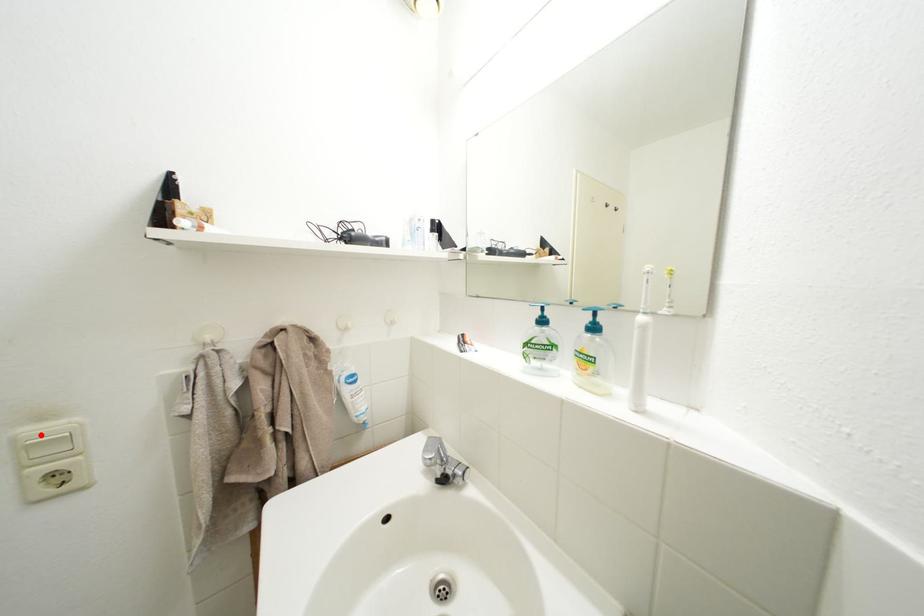
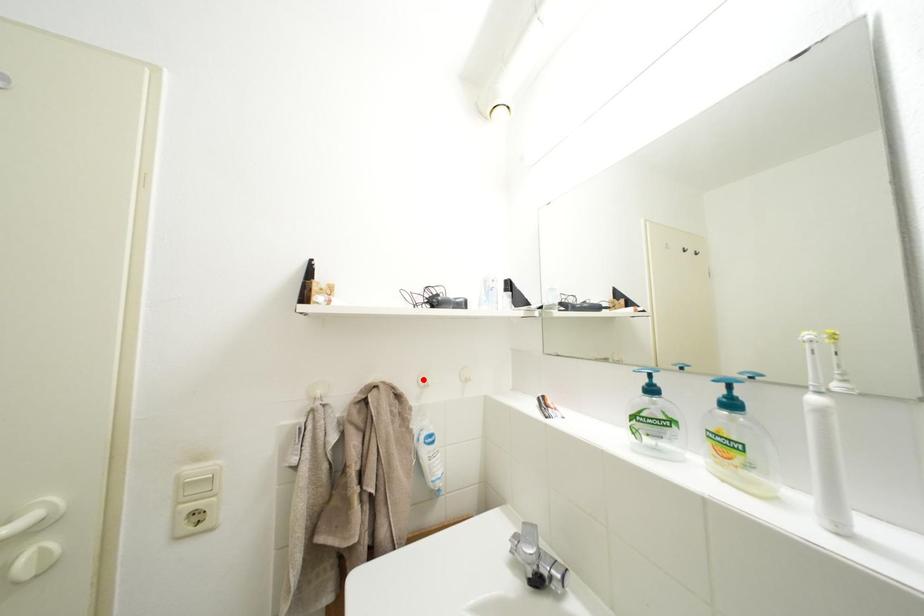
I am providing you with two images of the same scene from different viewpoints. A red point is marked on the first image and another point is marked on the second image. Is the red point in image1 aligned with the point shown in image2?

No